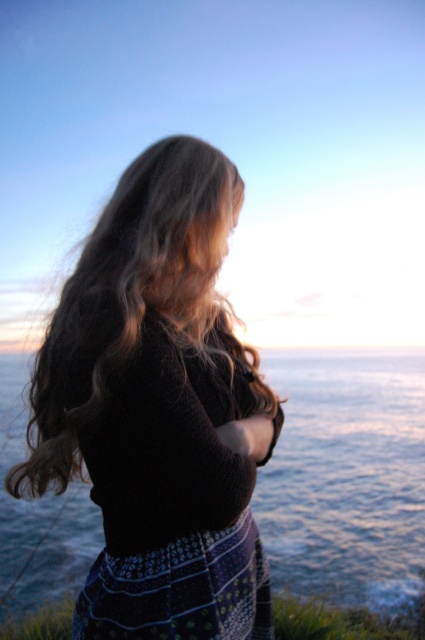
You are standing at the cliff edge and want to look at two points in the scene. The first point is at coordinates point (164, 172) and the second is at point (274, 528). Which point is closer to you?

Point (164, 172) is closer to the viewer than point (274, 528).

You are a photographer trying to capture the scene of the person at the cliff edge. You notice the knitted black sweater at center and the blue water at center. Which object is positioned higher in the image?

The knitted black sweater at center is above the blue water at center, so it is positioned higher in the image.

You are an artist trying to paint the scene. You need to decide the vertical positioning of the knitted black sweater at center and the blue water at center. Which one should be placed higher on the canvas?

The knitted black sweater at center is shorter than the blue water at center, so the blue water at center should be placed higher on the canvas since it is taller.